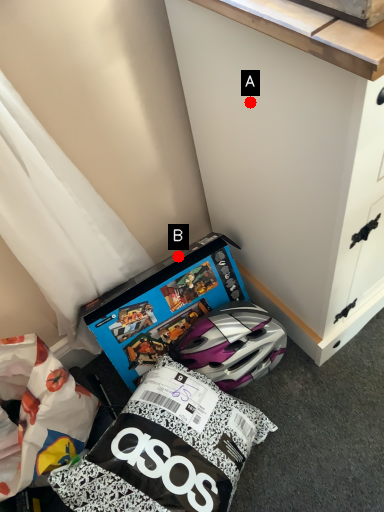
Question: Two points are circled on the image, labeled by A and B beside each circle. Among these points, which one is farthest from the camera?

Choices:
 (A) A is further
 (B) B is further

Answer: (B)